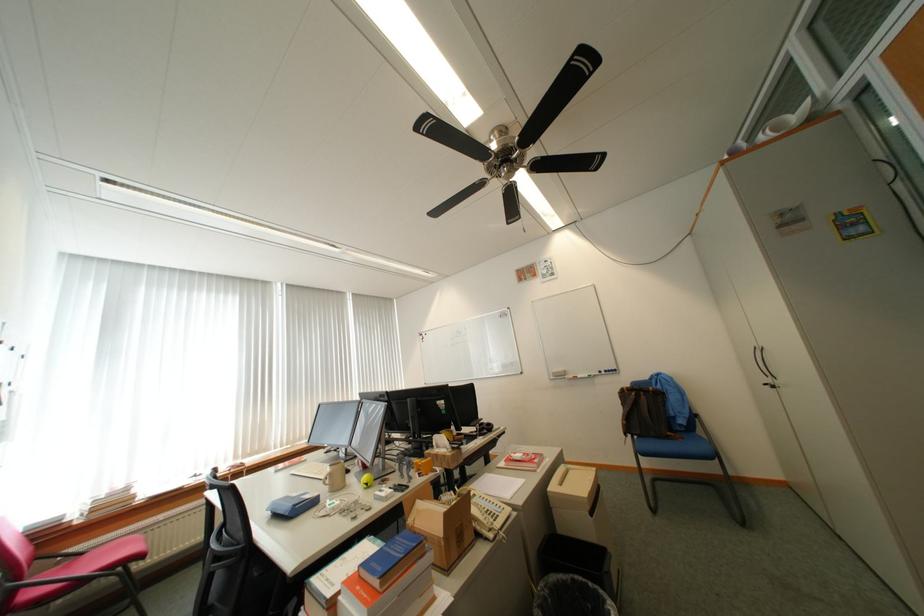
You are a GUI agent. You are given a task and a screenshot of the screen. Output one action in this format:
    pyautogui.click(x=<x>, y=<y>)
    Task: Click on the fan pull chain
    The height and width of the screenshot is (616, 924).
    Given the screenshot: What is the action you would take?
    pyautogui.click(x=505, y=174)